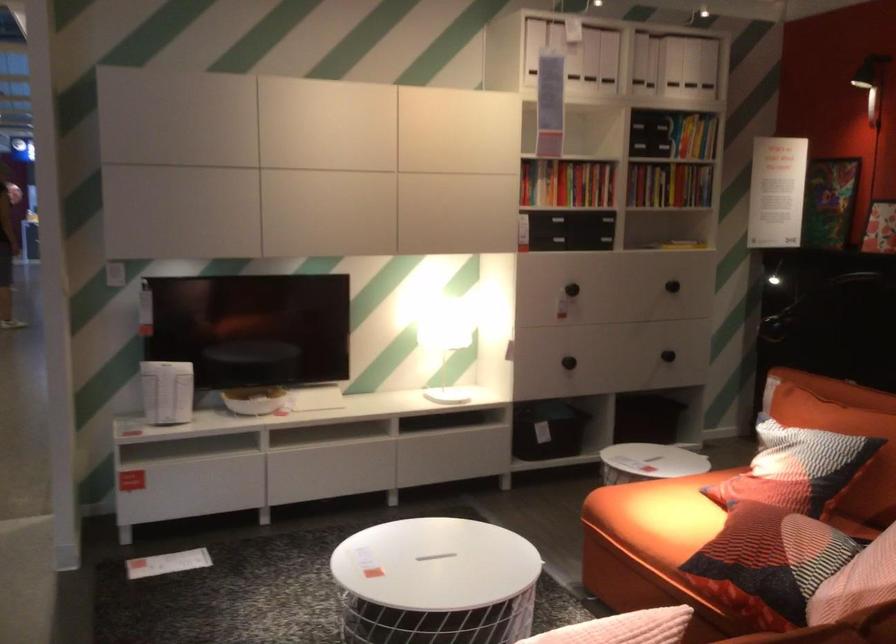
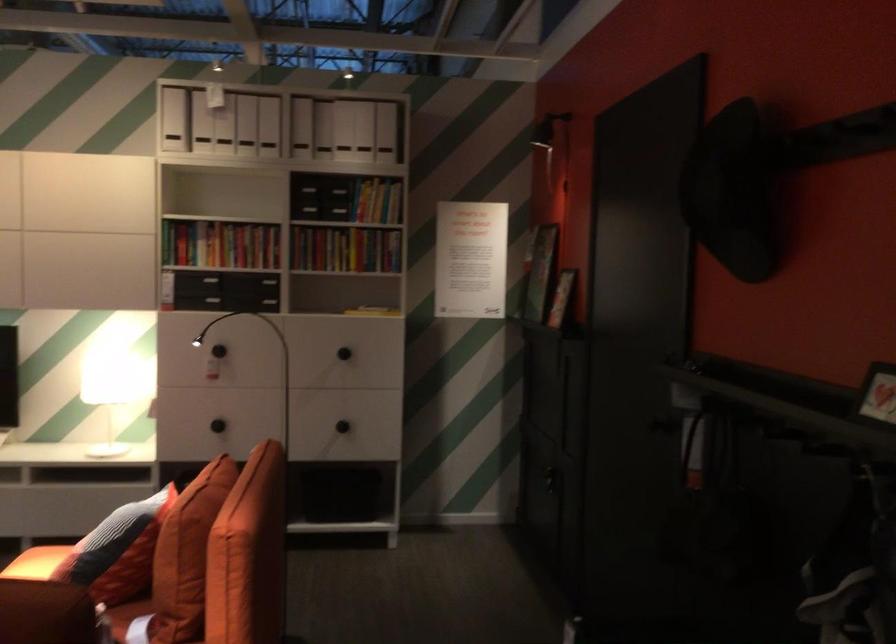
Find the pixel in the second image that matches point 694,161 in the first image.

(345, 249)